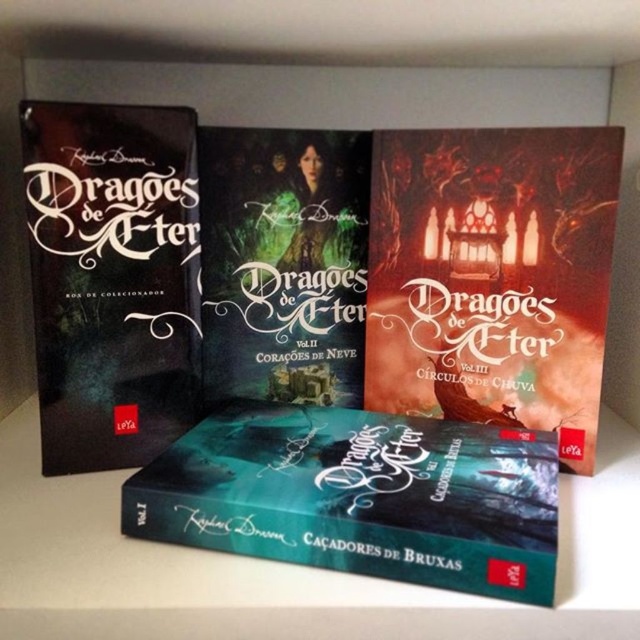
Which of these two, black matte book at left or matte green paper book at center, stands taller?

black matte book at left is taller.

The height and width of the screenshot is (640, 640). I want to click on black matte book at left, so click(112, 278).

Between point (173, 403) and point (326, 317), which one is positioned behind?

Point (326, 317)

Locate an element on the screen. black matte book at left is located at coordinates coord(112,278).

Which is in front, point (499, 348) or point (417, 484)?

Point (417, 484) is more forward.

Does dark matte book at center have a lesser width compared to teal glossy book at center?

Indeed, dark matte book at center has a lesser width compared to teal glossy book at center.

Between point (480, 164) and point (300, 422), which one is positioned behind?

The point (300, 422) is more distant.

Locate an element on the screen. dark matte book at center is located at coordinates (492, 276).

Can you confirm if dark matte book at center is positioned to the left of black matte book at left?

Incorrect, dark matte book at center is not on the left side of black matte book at left.

Looking at this image, who is positioned more to the right, dark matte book at center or black matte book at left?

dark matte book at center is more to the right.

Based on the photo, who is more forward, (451, 308) or (104, 449)?

Positioned in front is point (104, 449).

At what (x,y) coordinates should I click in order to perform the action: click on dark matte book at center. Please return your answer as a coordinate pair (x, y). Looking at the image, I should click on (492, 276).